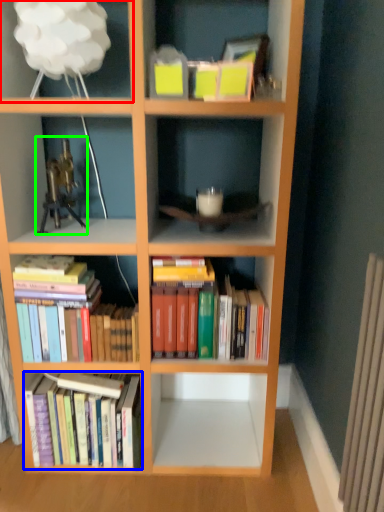
Question: Which object is positioned closest to shelf (highlighted by a red box)? Select from book (highlighted by a blue box) and toy (highlighted by a green box).

Choices:
 (A) book
 (B) toy

Answer: (B)